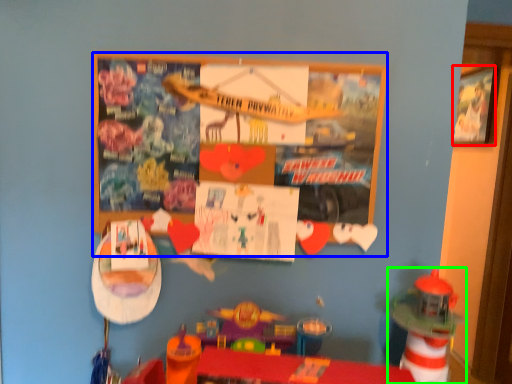
Question: Which object is the closest to the picture frame (highlighted by a red box)? Choose among these: bulletin board (highlighted by a blue box) or toy (highlighted by a green box).

Choices:
 (A) bulletin board
 (B) toy

Answer: (B)